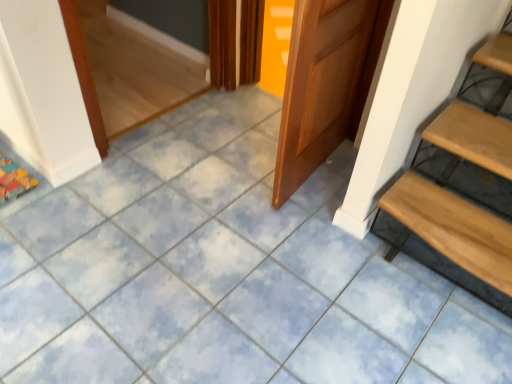
What do you see at coordinates (322, 84) in the screenshot? I see `wooden door at center` at bounding box center [322, 84].

Locate an element on the screen. This screenshot has width=512, height=384. wooden door at center is located at coordinates (322, 84).

Image resolution: width=512 pixels, height=384 pixels. Describe the element at coordinates (462, 190) in the screenshot. I see `light brown wooden stairs at lower right` at that location.

In order to face light brown wooden stairs at lower right, should I rotate leftwards or rightwards?

A 26.916 degree turn to the right will do.

The height and width of the screenshot is (384, 512). Find the location of `light brown wooden stairs at lower right`. light brown wooden stairs at lower right is located at coordinates (462, 190).

From the picture: Measure the distance between light brown wooden stairs at lower right and camera.

light brown wooden stairs at lower right and camera are 4.72 feet apart from each other.

Find the location of a particular element. The image size is (512, 384). wooden door at center is located at coordinates (322, 84).

Considering the relative positions of wooden door at center and light brown wooden stairs at lower right in the image provided, is wooden door at center to the left of light brown wooden stairs at lower right from the viewer's perspective?

Yes.

Is wooden door at center in front of or behind light brown wooden stairs at lower right in the image?

wooden door at center is positioned closer to the viewer than light brown wooden stairs at lower right.

Does point (339, 34) come closer to viewer compared to point (441, 214)?

Yes, it is.

From the image's perspective, is wooden door at center under light brown wooden stairs at lower right?

Actually, wooden door at center appears above light brown wooden stairs at lower right in the image.

From a real-world perspective, between wooden door at center and light brown wooden stairs at lower right, who is vertically higher?

From a 3D spatial view, wooden door at center is above.

Consider the image. Considering the sizes of objects wooden door at center and light brown wooden stairs at lower right in the image provided, who is thinner, wooden door at center or light brown wooden stairs at lower right?

wooden door at center is thinner.

Who is taller, wooden door at center or light brown wooden stairs at lower right?

With more height is wooden door at center.

Can you confirm if wooden door at center is smaller than light brown wooden stairs at lower right?

Indeed, wooden door at center has a smaller size compared to light brown wooden stairs at lower right.

Is wooden door at center spatially inside light brown wooden stairs at lower right, or outside of it?

wooden door at center is not inside light brown wooden stairs at lower right, it's outside.

Is wooden door at center far away from light brown wooden stairs at lower right?

No, wooden door at center is not far away from light brown wooden stairs at lower right.

Is wooden door at center oriented away from light brown wooden stairs at lower right?

Yes.

What's the angular difference between wooden door at center and light brown wooden stairs at lower right's facing directions?

86 degrees separate the facing orientations of wooden door at center and light brown wooden stairs at lower right.

I want to click on door above the light brown wooden stairs at lower right (from a real-world perspective), so click(x=322, y=84).

Is light brown wooden stairs at lower right to the left or to the right of wooden door at center in the image?

light brown wooden stairs at lower right is to the right of wooden door at center.

Does light brown wooden stairs at lower right lie behind wooden door at center?

Yes, the depth of light brown wooden stairs at lower right is greater than that of wooden door at center.

Which is more distant, (x=498, y=295) or (x=322, y=119)?

The point (x=322, y=119) is farther.

From the image's perspective, does light brown wooden stairs at lower right appear higher than wooden door at center?

No, from the image's perspective, light brown wooden stairs at lower right is not on top of wooden door at center.

From a real-world perspective, who is located higher, light brown wooden stairs at lower right or wooden door at center?

From a 3D spatial view, wooden door at center is above.

Is light brown wooden stairs at lower right wider than wooden door at center?

Correct, the width of light brown wooden stairs at lower right exceeds that of wooden door at center.

Can you confirm if light brown wooden stairs at lower right is taller than wooden door at center?

No.

In terms of size, does light brown wooden stairs at lower right appear bigger or smaller than wooden door at center?

light brown wooden stairs at lower right is bigger than wooden door at center.

Consider the image. Do you think light brown wooden stairs at lower right is within wooden door at center, or outside of it?

light brown wooden stairs at lower right is spatially situated outside wooden door at center.

Are light brown wooden stairs at lower right and wooden door at center located far from each other?

light brown wooden stairs at lower right is actually quite close to wooden door at center.

Is light brown wooden stairs at lower right oriented away from wooden door at center?

light brown wooden stairs at lower right is not turned away from wooden door at center.

Where is `door lying above the light brown wooden stairs at lower right (from the image's perspective)`? The width and height of the screenshot is (512, 384). door lying above the light brown wooden stairs at lower right (from the image's perspective) is located at coordinates (322, 84).

Locate an element on the screen. The width and height of the screenshot is (512, 384). stairs directly beneath the wooden door at center (from a real-world perspective) is located at coordinates (462, 190).

Locate an element on the screen. door above the light brown wooden stairs at lower right (from the image's perspective) is located at coordinates (322, 84).